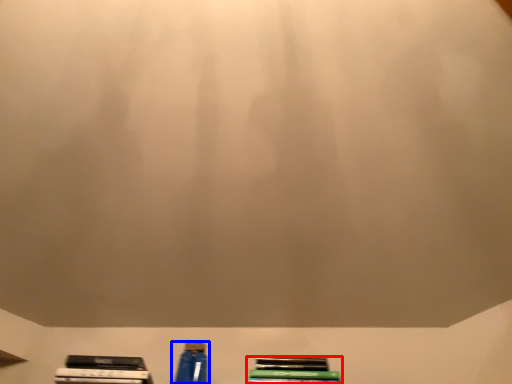
Question: Among these objects, which one is nearest to the camera, book (highlighted by a red box) or bottle (highlighted by a blue box)?

Choices:
 (A) book
 (B) bottle

Answer: (A)